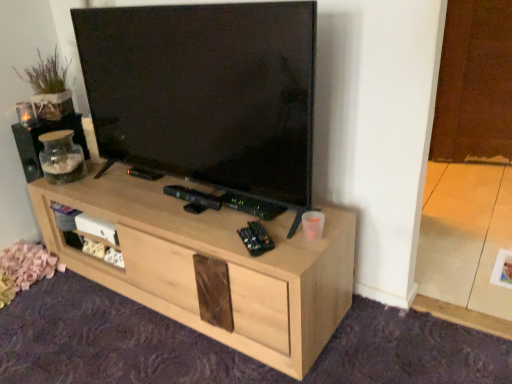
Question: From the image's perspective, is matte glass jar at left located above or below natural wood tv stand at center?

Choices:
 (A) above
 (B) below

Answer: (A)

Question: Is matte glass jar at left inside the boundaries of natural wood tv stand at center, or outside?

Choices:
 (A) outside
 (B) inside

Answer: (A)

Question: Relative to natural wood tv stand at center, is matte glass jar at left in front or behind?

Choices:
 (A) front
 (B) behind

Answer: (B)

Question: From the image's perspective, is natural wood tv stand at center above or below matte glass jar at left?

Choices:
 (A) above
 (B) below

Answer: (B)

Question: From their relative heights in the image, would you say natural wood tv stand at center is taller or shorter than matte glass jar at left?

Choices:
 (A) tall
 (B) short

Answer: (A)

Question: Choose the correct answer: Is natural wood tv stand at center inside matte glass jar at left or outside it?

Choices:
 (A) outside
 (B) inside

Answer: (A)

Question: Is point pos(349,273) positioned closer to the camera than point pos(18,122)?

Choices:
 (A) closer
 (B) farther

Answer: (A)